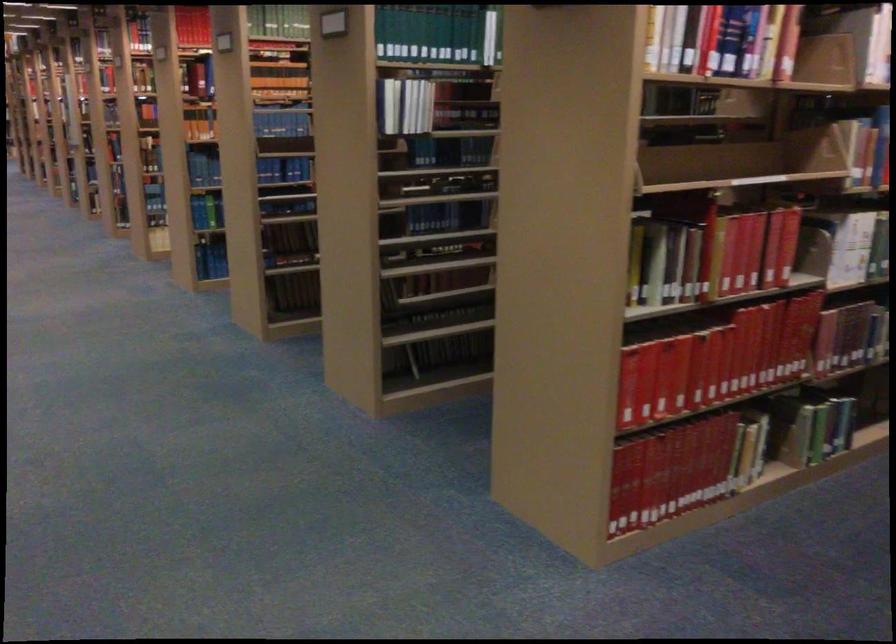
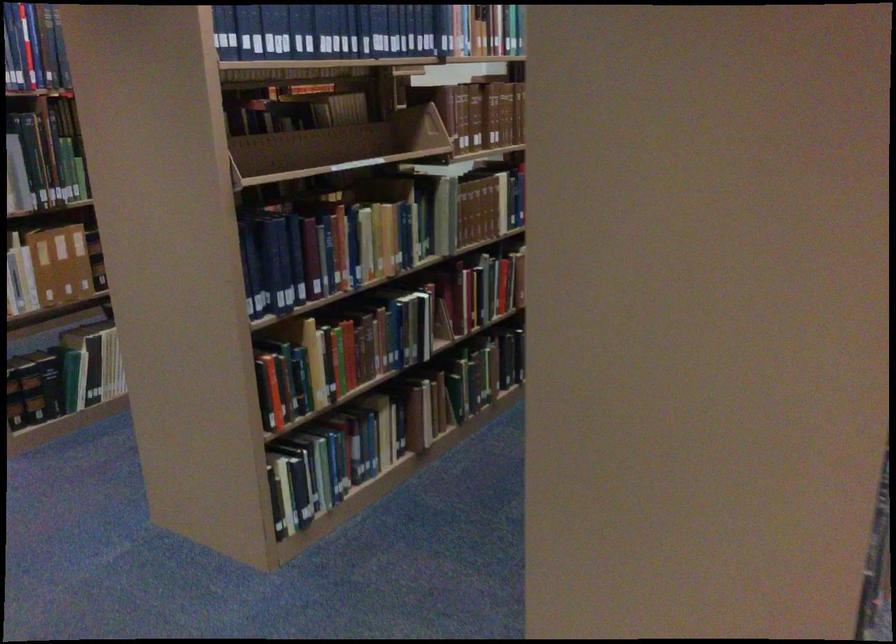
In a continuous first-person perspective shot, in which direction is the camera moving?

The movement direction of the cameraman is right, backward.